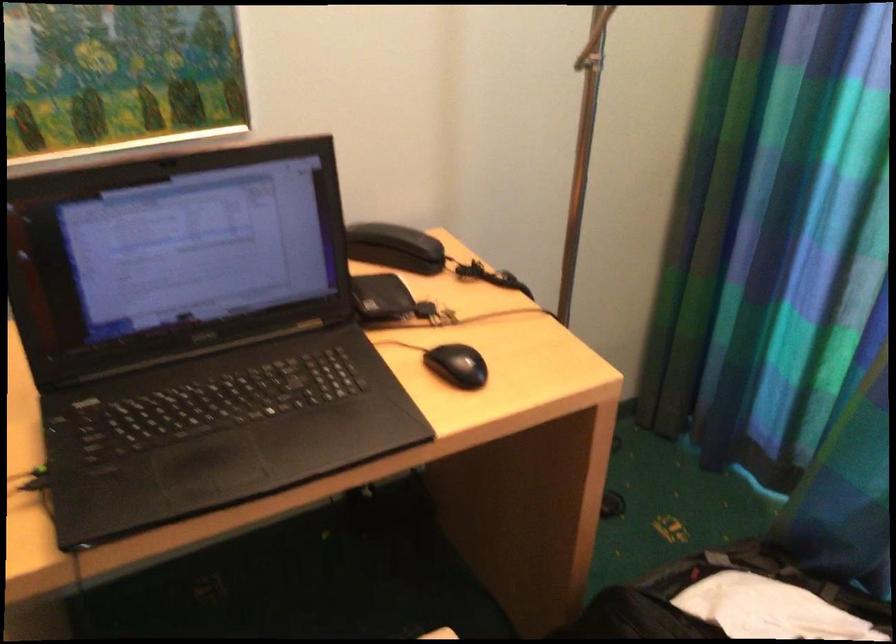
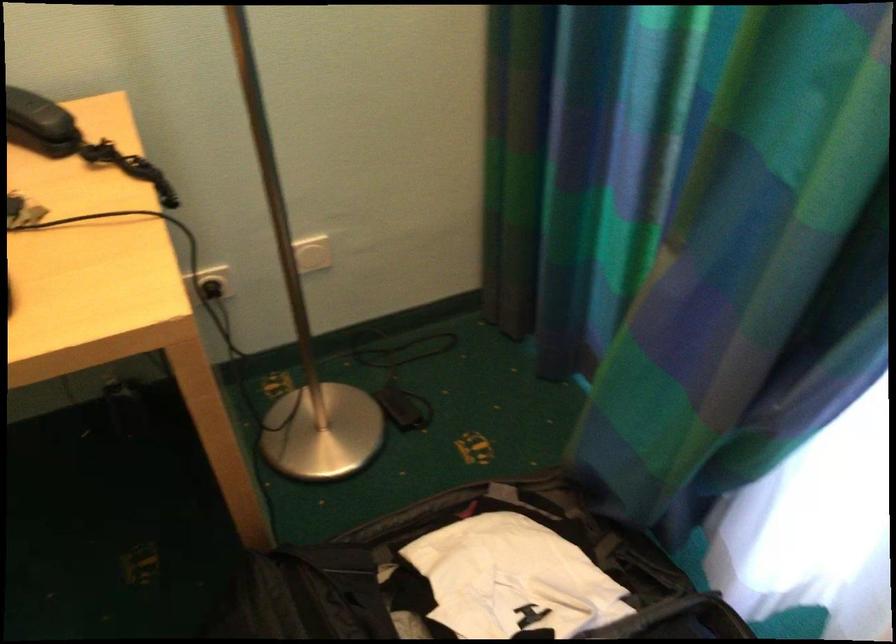
In a continuous first-person perspective shot, in which direction is the camera moving?

The movement direction of the cameraman is right, forward.